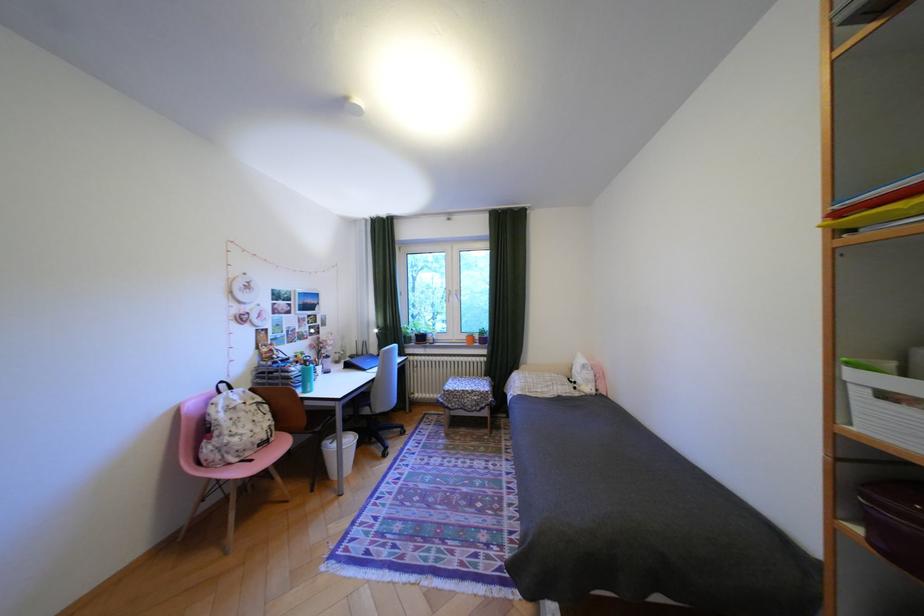
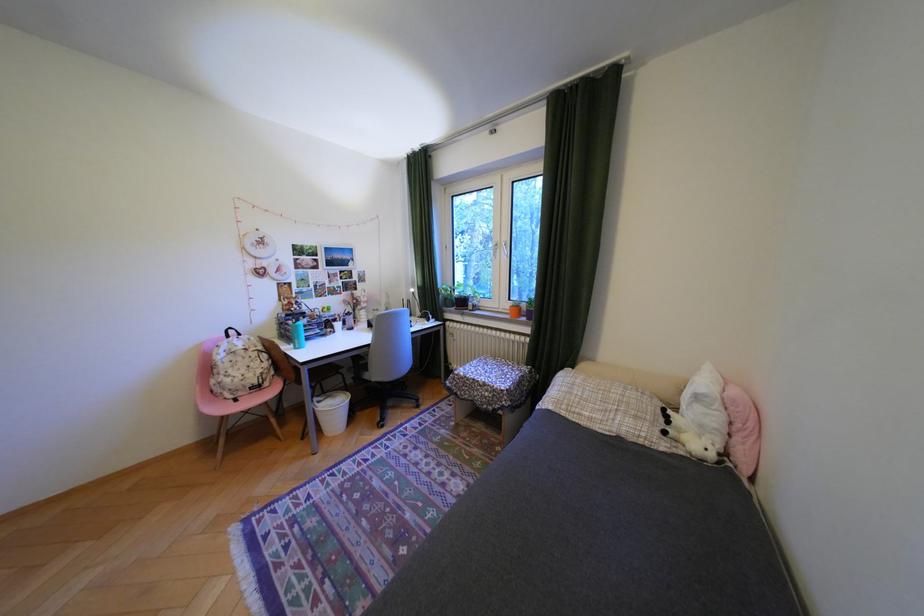
Where in the second image is the point corresponding to (x=433, y=339) from the first image?

(475, 302)